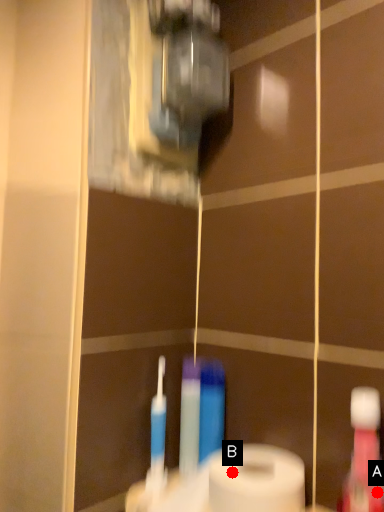
Question: Two points are circled on the image, labeled by A and B beside each circle. Which point is closer to the camera?

Choices:
 (A) A is closer
 (B) B is closer

Answer: (A)